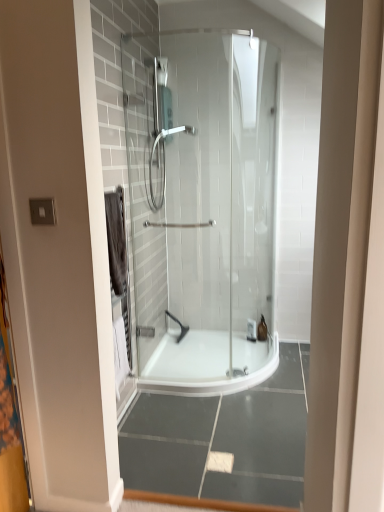
Question: Does black rubber showerhead at center, marked as the second shower in a top-to-bottom arrangement, lie behind white plastic bottle at center, which is the first toiletry from left to right?

Choices:
 (A) no
 (B) yes

Answer: (B)

Question: Is black rubber showerhead at center, the first shower from the back, at the left side of white plastic bottle at center, arranged as the 2th toiletry when viewed from the right?

Choices:
 (A) no
 (B) yes

Answer: (B)

Question: Are black rubber showerhead at center, which ranks as the 2th shower in front-to-back order, and white plastic bottle at center, which is the first toiletry from left to right, far apart?

Choices:
 (A) yes
 (B) no

Answer: (B)

Question: Does black rubber showerhead at center, which ranks as the 2th shower in front-to-back order, have a lesser height compared to white plastic bottle at center, arranged as the 2th toiletry when viewed from the right?

Choices:
 (A) no
 (B) yes

Answer: (A)

Question: From the image's perspective, would you say black rubber showerhead at center, which ranks as the 2th shower in front-to-back order, is shown under white plastic bottle at center, arranged as the 2th toiletry when viewed from the right?

Choices:
 (A) yes
 (B) no

Answer: (B)

Question: From a real-world perspective, is black rubber showerhead at center, which is counted as the first shower, starting from the bottom, beneath white plastic bottle at center, arranged as the 2th toiletry when viewed from the right?

Choices:
 (A) no
 (B) yes

Answer: (A)

Question: Considering the relative positions of white plastic bottle at center, arranged as the 2th toiletry when viewed from the right, and translucent glass toiletry at center, the 1th toiletry when ordered from right to left, in the image provided, is white plastic bottle at center, arranged as the 2th toiletry when viewed from the right, behind translucent glass toiletry at center, the 1th toiletry when ordered from right to left,?

Choices:
 (A) yes
 (B) no

Answer: (B)

Question: Considering the relative sizes of white plastic bottle at center, which is the first toiletry from left to right, and translucent glass toiletry at center, which ranks as the second toiletry in left-to-right order, in the image provided, is white plastic bottle at center, which is the first toiletry from left to right, shorter than translucent glass toiletry at center, which ranks as the second toiletry in left-to-right order,?

Choices:
 (A) no
 (B) yes

Answer: (B)

Question: Is translucent glass toiletry at center, which ranks as the second toiletry in left-to-right order, a part of white plastic bottle at center, arranged as the 2th toiletry when viewed from the right?

Choices:
 (A) no
 (B) yes

Answer: (A)

Question: Does white plastic bottle at center, arranged as the 2th toiletry when viewed from the right, have a lesser width compared to translucent glass toiletry at center, the 1th toiletry when ordered from right to left?

Choices:
 (A) no
 (B) yes

Answer: (B)

Question: From the image's perspective, would you say white plastic bottle at center, arranged as the 2th toiletry when viewed from the right, is shown under translucent glass toiletry at center, the 1th toiletry when ordered from right to left?

Choices:
 (A) yes
 (B) no

Answer: (A)

Question: Is the depth of white plastic bottle at center, which is the first toiletry from left to right, less than that of translucent glass toiletry at center, which ranks as the second toiletry in left-to-right order?

Choices:
 (A) yes
 (B) no

Answer: (A)

Question: Does matte silver shower head at center, the 1th shower when ordered from top to bottom, have a lesser height compared to black rubber showerhead at center, which ranks as the 2th shower in front-to-back order?

Choices:
 (A) no
 (B) yes

Answer: (A)